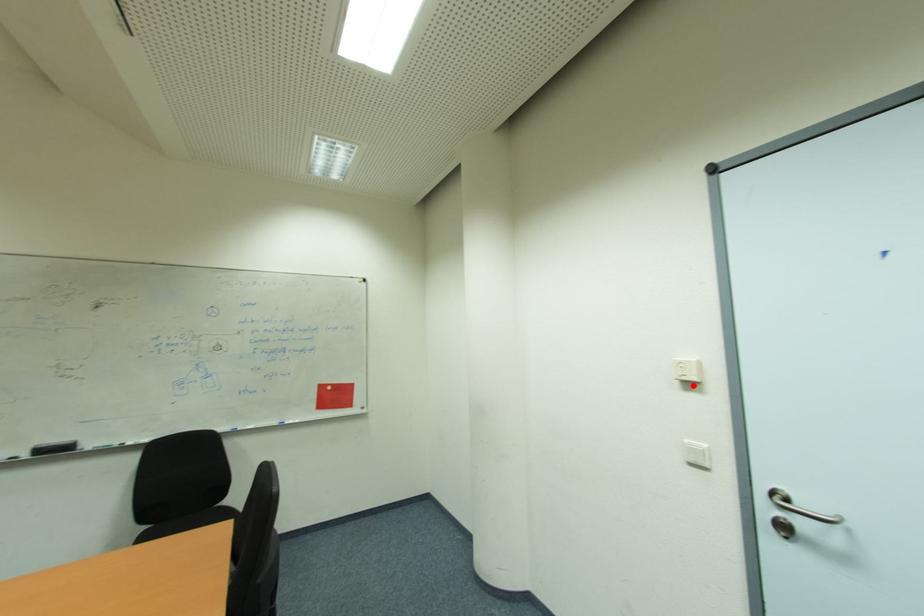
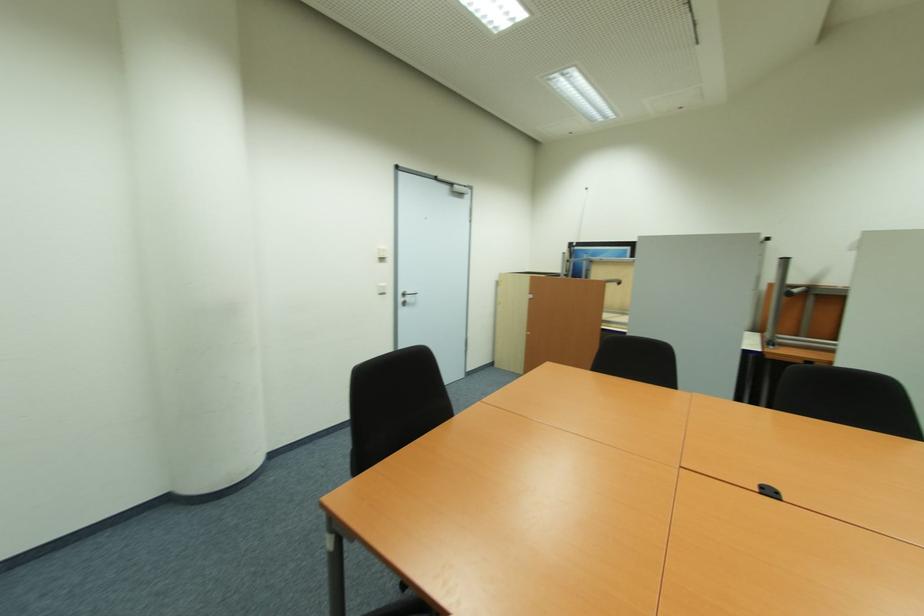
Find the pixel in the second image that matches the highlighted location in the first image.

(385, 260)